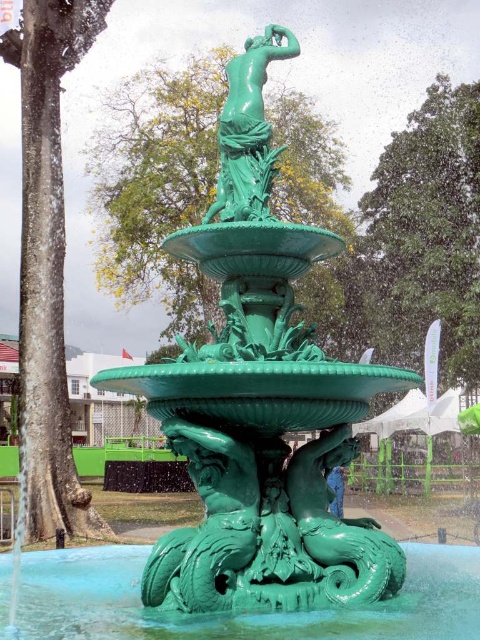
Question: Which point appears farthest from the camera in this image?

Choices:
 (A) (249, 113)
 (B) (85, 586)
 (C) (276, 152)

Answer: (A)

Question: Among these objects, which one is farthest from the camera?

Choices:
 (A) green patinated bronze statue at upper center
 (B) green glossy water at center
 (C) green polished fountain at center

Answer: (A)

Question: Which object is closer to the camera taking this photo?

Choices:
 (A) green glossy water at center
 (B) green patinated bronze statue at upper center

Answer: (A)

Question: Where is green polished fountain at center located in relation to green patinated bronze statue at upper center in the image?

Choices:
 (A) left
 (B) right

Answer: (B)

Question: Is green polished fountain at center smaller than green patinated bronze statue at upper center?

Choices:
 (A) yes
 (B) no

Answer: (B)

Question: Observing the image, what is the correct spatial positioning of green polished fountain at center in reference to green glossy water at center?

Choices:
 (A) below
 (B) above

Answer: (B)